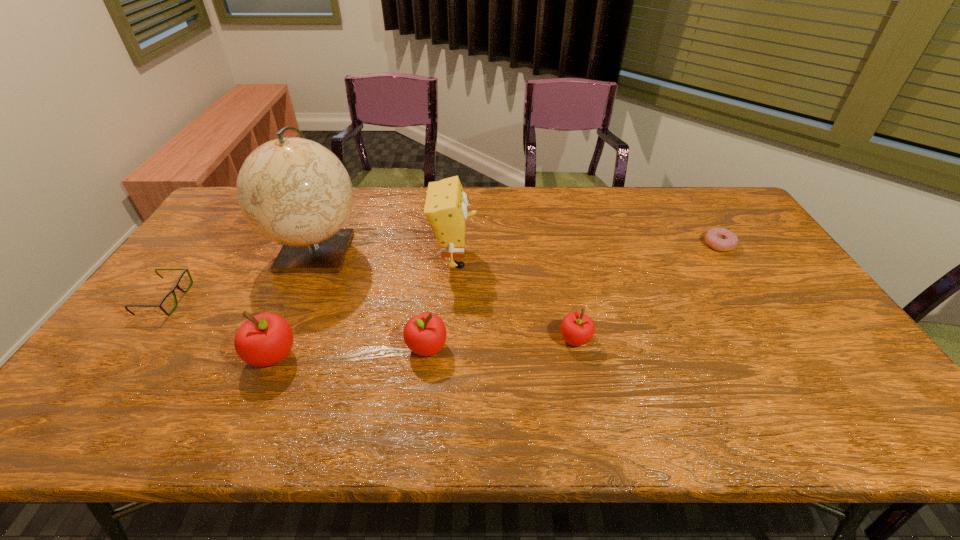
I want to click on vacant area that satisfies the following two spatial constraints: 1. on the lens of the leftmost object; 2. on the left side of the fourth shortest object, so click(x=129, y=347).

Locate an element on the screen. The image size is (960, 540). free region that satisfies the following two spatial constraints: 1. on the surface of the third tallest object showing Europe and Africa; 2. on the left side of the globe is located at coordinates (270, 355).

Find the location of `vacant space that satisfies the following two spatial constraints: 1. on the front side of the shortest object; 2. on the lens of the leftmost object`. vacant space that satisfies the following two spatial constraints: 1. on the front side of the shortest object; 2. on the lens of the leftmost object is located at coordinates (755, 299).

At what (x,y) coordinates should I click in order to perform the action: click on vacant region that satisfies the following two spatial constraints: 1. on the surface of the second apple from right to left showing Europe and Africa; 2. on the right side of the globe. Please return your answer as a coordinate pair (x, y). This screenshot has height=540, width=960. Looking at the image, I should click on (274, 347).

Locate an element on the screen. vacant area in the image that satisfies the following two spatial constraints: 1. on the surface of the fourth shortest object showing Europe and Africa; 2. on the right side of the tallest object is located at coordinates (274, 347).